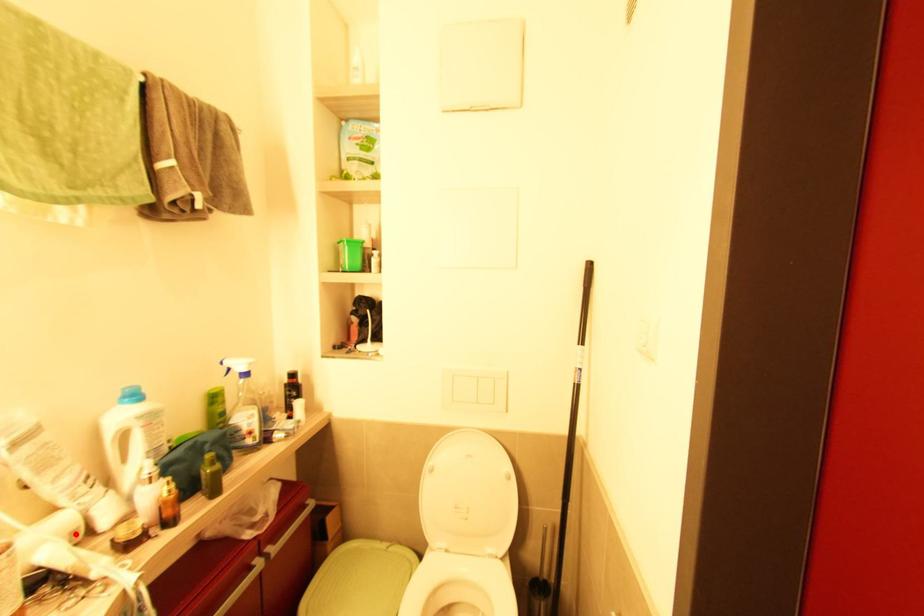
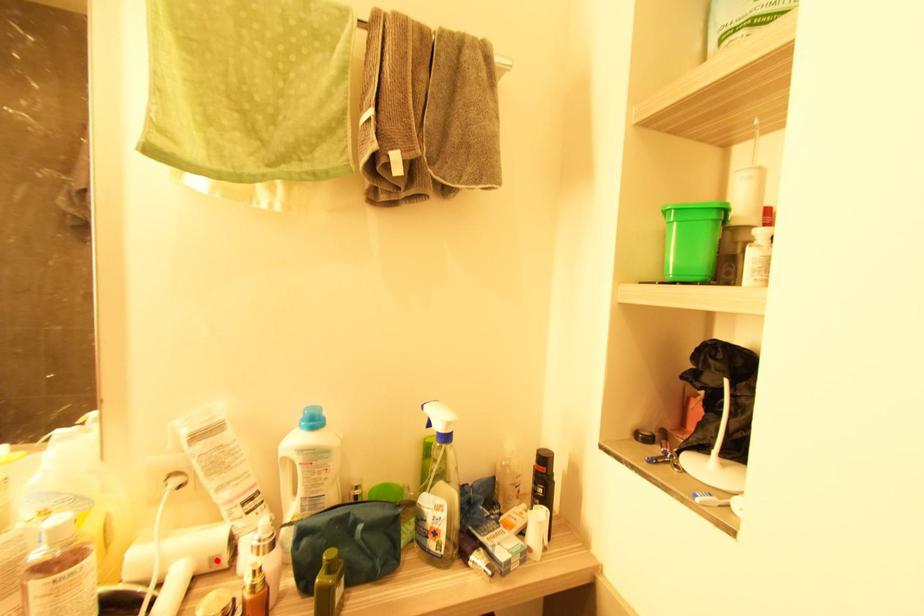
I am providing you with two images of the same scene from different viewpoints. A red point is marked on the first image and another point is marked on the second image. Is the marked point in image1 the same physical position as the marked point in image2?

Yes